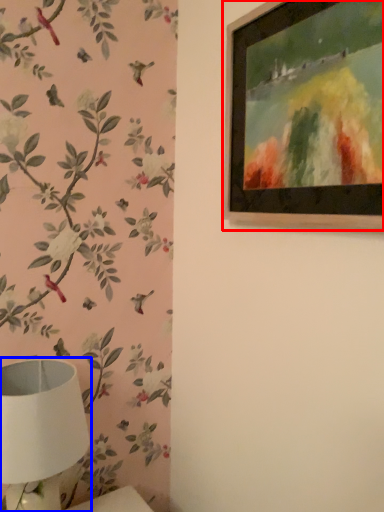
Question: Which object is further to the camera taking this photo, picture frame (highlighted by a red box) or table lamp (highlighted by a blue box)?

Choices:
 (A) picture frame
 (B) table lamp

Answer: (B)